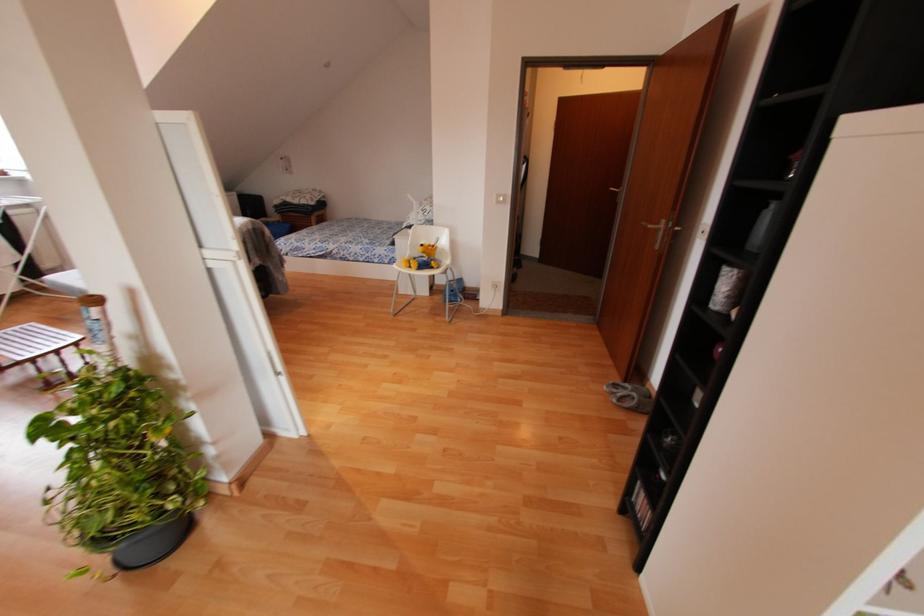
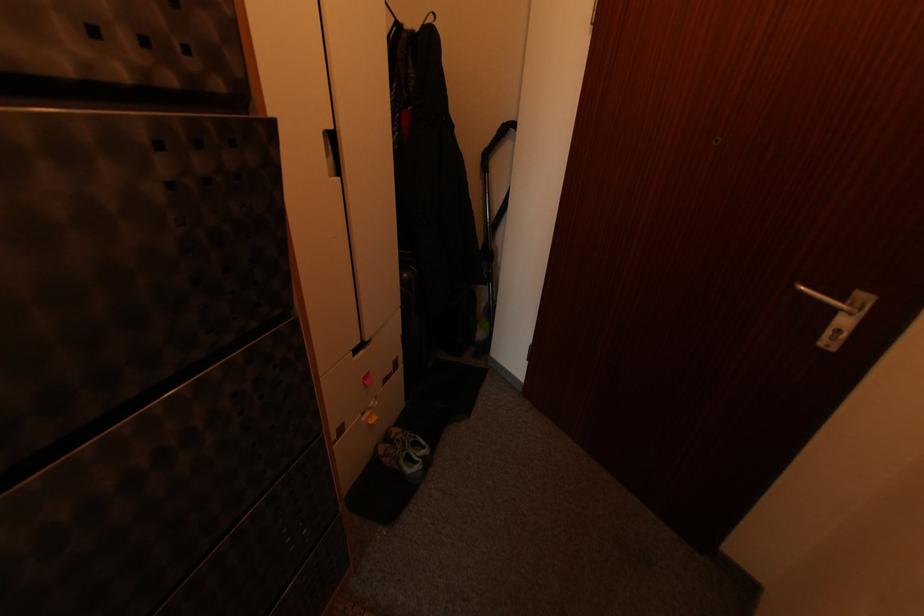
Find the pixel in the second image that matches pixel 611 188 in the first image.

(804, 289)